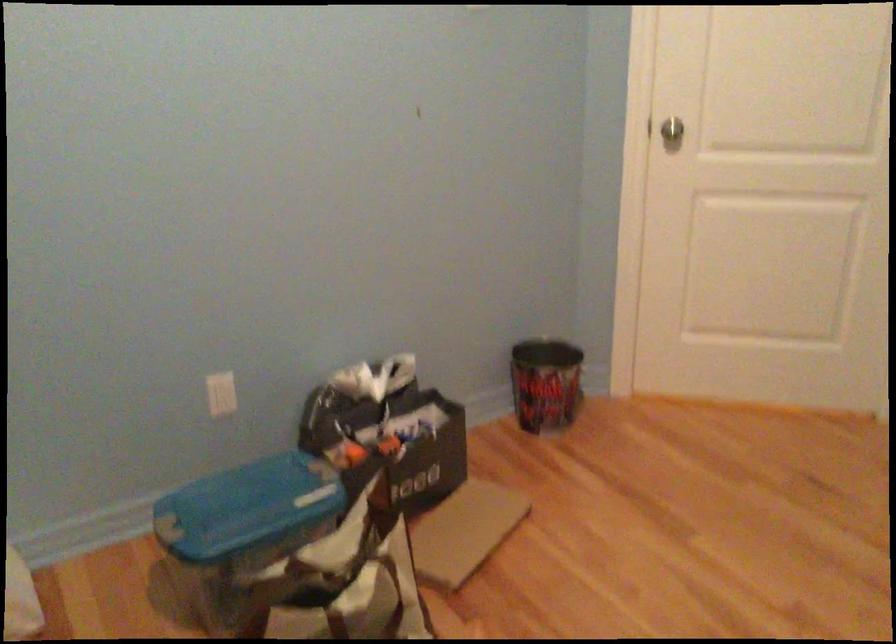
Find where to lift the blue container lid. Please return your answer as a coordinate pair (x, y).

(247, 507)